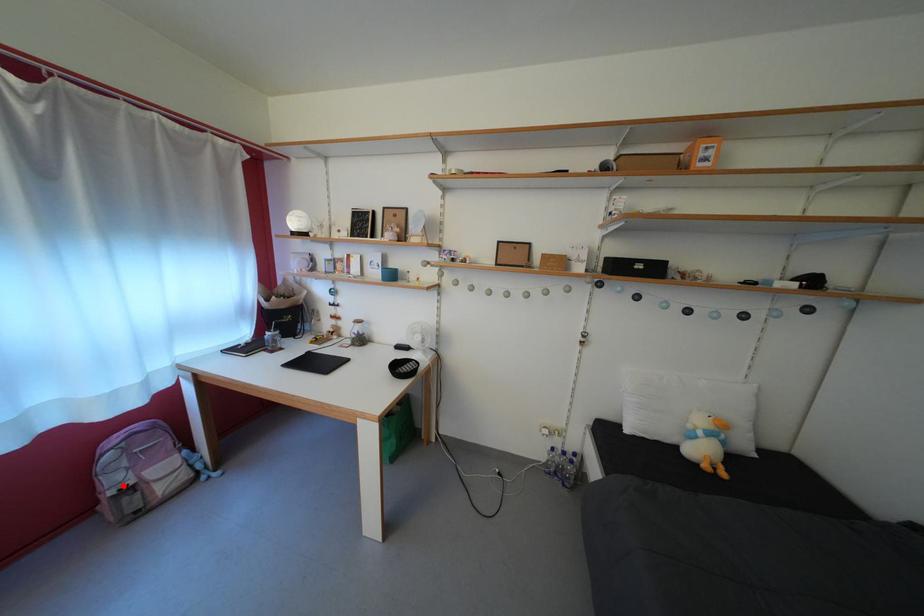
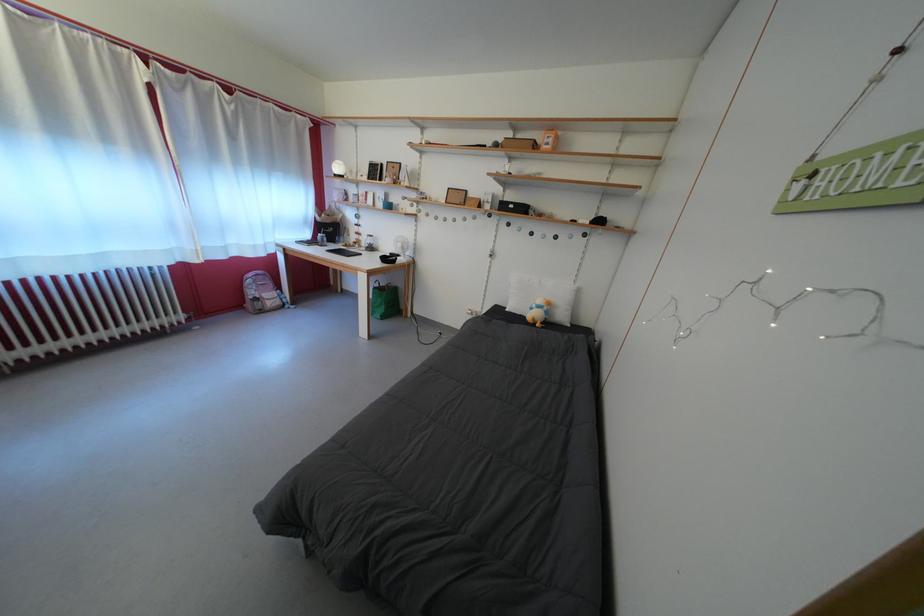
Find the pixel in the second image that matches the highlighted location in the first image.

(261, 299)